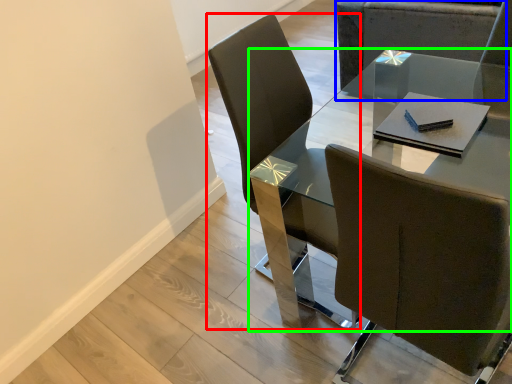
Question: Estimate the real-world distances between objects in this image. Which object is farther from chair (highlighted by a red box), chair (highlighted by a blue box) or table (highlighted by a green box)?

Choices:
 (A) chair
 (B) table

Answer: (A)